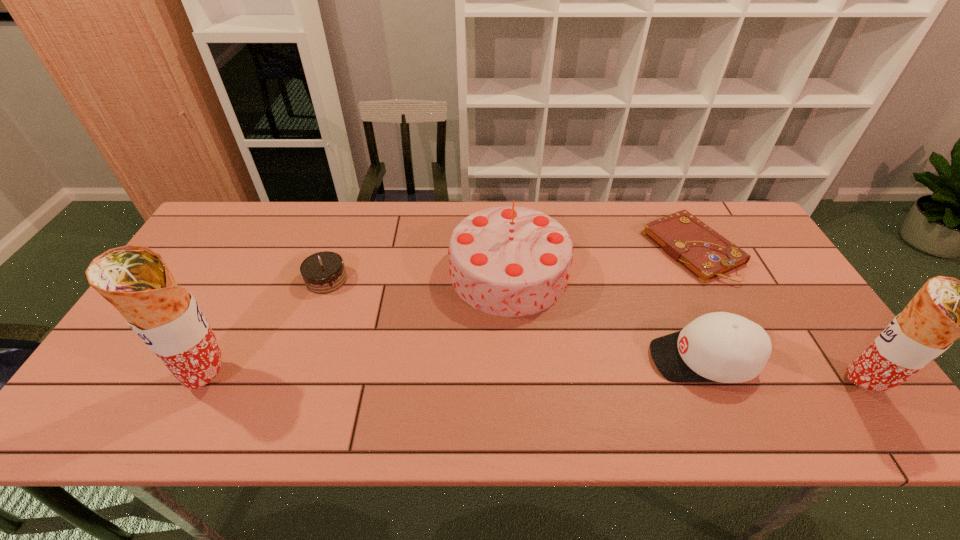
Identify the location of vacant space located 0.170m on the back of the taller burrito. Image resolution: width=960 pixels, height=540 pixels. click(x=246, y=305).

What are the coordinates of `vacant region located on the left of the rightmost object` in the screenshot? It's located at (758, 385).

The image size is (960, 540). Identify the location of vacant space located 0.280m on the back of the fifth tallest object. (350, 209).

At what (x,y) coordinates should I click in order to perform the action: click on free space located 0.110m on the left of the shortest object. Please return your answer as a coordinate pair (x, y). Looking at the image, I should click on pyautogui.click(x=612, y=249).

The width and height of the screenshot is (960, 540). What are the coordinates of `vacant point located 0.180m on the right of the fourth shortest object` in the screenshot? It's located at (631, 273).

At what (x,y) coordinates should I click in order to perform the action: click on blank space located 0.400m on the front-facing side of the fourth tallest object. Please return your answer as a coordinate pair (x, y). The image size is (960, 540). Looking at the image, I should click on [486, 359].

I want to click on blank area located 0.370m on the front-facing side of the fourth tallest object, so coord(498,359).

Where is `vacant region located on the front-facing side of the fourth tallest object`? vacant region located on the front-facing side of the fourth tallest object is located at coordinates (527, 359).

Locate an element on the screen. notebook located in the far edge section of the desktop is located at coordinates (705, 253).

The image size is (960, 540). What are the coordinates of `birthday cake that is at the far edge` in the screenshot? It's located at point(511,261).